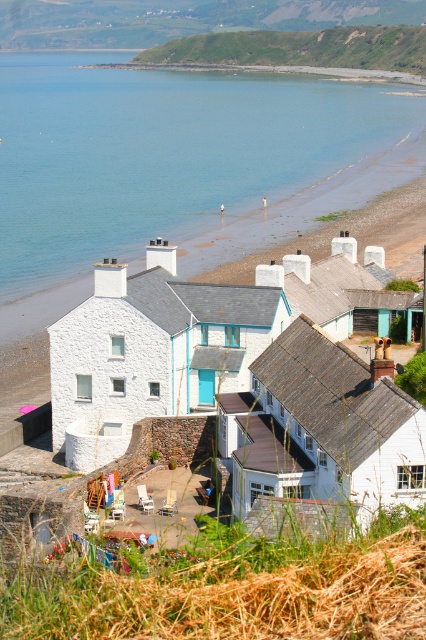
Question: Which point is farther to the camera?

Choices:
 (A) blue water at center
 (B) white wood house at center
 (C) white stone house at center

Answer: (A)

Question: Among these points, which one is farthest from the camera?

Choices:
 (A) (144, 339)
 (B) (331, 52)
 (C) (259, 179)

Answer: (B)

Question: Can you confirm if white stone house at center is positioned to the right of green grassy hillside at upper center?

Choices:
 (A) no
 (B) yes

Answer: (A)

Question: Among these points, which one is nearest to the camera?

Choices:
 (A) (365, 40)
 (B) (325, 387)
 (C) (149, 225)
 (D) (215, 298)

Answer: (B)

Question: Can you confirm if white wood house at center is smaller than green grassy hillside at upper center?

Choices:
 (A) yes
 (B) no

Answer: (A)

Question: In this image, where is blue water at center located relative to white stone house at center?

Choices:
 (A) right
 (B) left

Answer: (A)